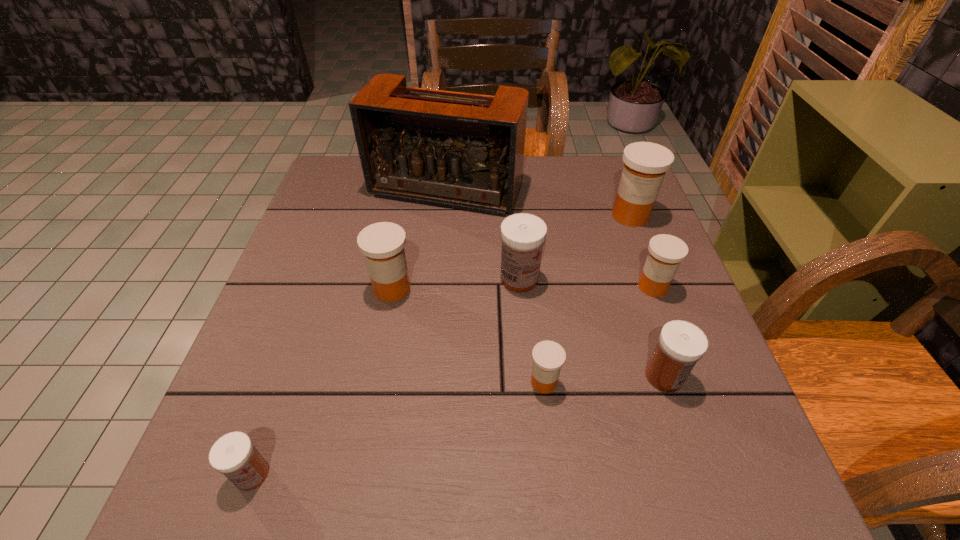
Find the location of a particular element. This screenshot has width=960, height=540. the tallest object is located at coordinates (465, 151).

This screenshot has width=960, height=540. Identify the location of the tallest medicine. (645, 164).

The width and height of the screenshot is (960, 540). I want to click on the second tallest object, so click(645, 164).

Identify the location of the second white medicine from right to left. (523, 235).

You are a GUI agent. You are given a task and a screenshot of the screen. Output one action in this format:
    pyautogui.click(x=<x>, y=<y>)
    Task: Click on the biggest white medicine
    
    Given the screenshot: What is the action you would take?
    pyautogui.click(x=523, y=235)

I want to click on the sixth medicine from right to left, so click(382, 243).

The width and height of the screenshot is (960, 540). Find the location of `the second biggest orange medicine`. the second biggest orange medicine is located at coordinates tap(382, 243).

Find the location of a particular element. Image resolution: width=960 pixels, height=540 pixels. the third biggest orange medicine is located at coordinates (666, 252).

Identify the location of the second smallest white medicine. (681, 344).

At what (x,y) coordinates should I click in order to perform the action: click on the rightmost white medicine. Please return your answer as a coordinate pair (x, y). The image size is (960, 540). Looking at the image, I should click on (681, 344).